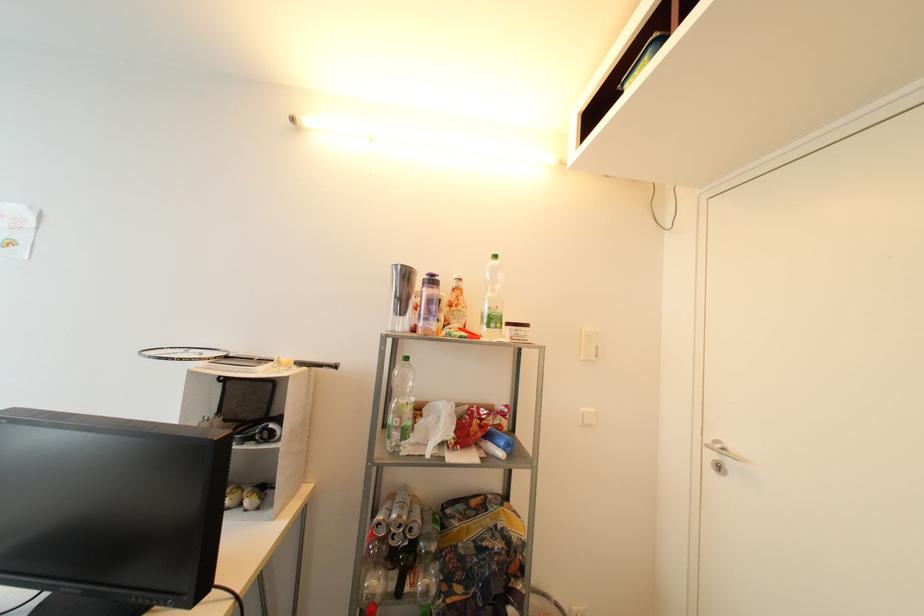
Locate an element on the screen. Image resolution: width=924 pixels, height=616 pixels. silver door handle is located at coordinates (724, 451).